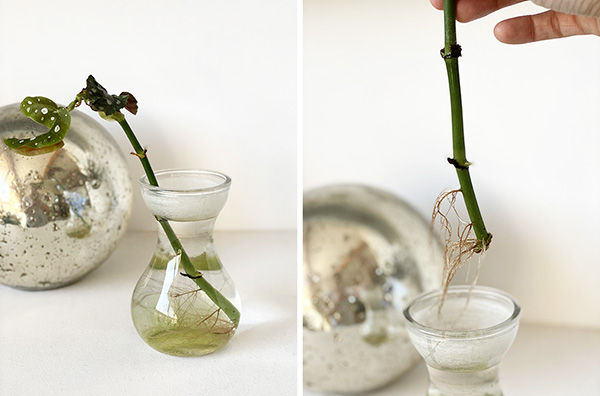
Find the location of a particular element. Image resolution: width=600 pixels, height=396 pixels. glass vase is located at coordinates (224, 269), (446, 358).